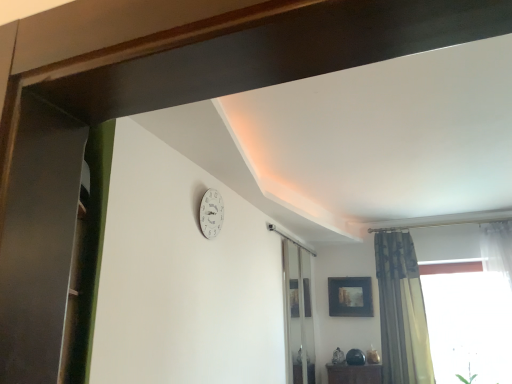
Question: Would you say textured beige curtain at right is part of transparent glass screen door at center, the 2th screen door viewed from the front,'s contents?

Choices:
 (A) no
 (B) yes

Answer: (A)

Question: From the image's perspective, is transparent glass screen door at center, which is the 1th screen door in back-to-front order, below textured beige curtain at right?

Choices:
 (A) yes
 (B) no

Answer: (A)

Question: Is transparent glass screen door at center, which is the 1th screen door in back-to-front order, facing towards textured beige curtain at right?

Choices:
 (A) no
 (B) yes

Answer: (B)

Question: Is transparent glass screen door at center, placed as the second screen door when sorted from left to right, at the left side of textured beige curtain at right?

Choices:
 (A) no
 (B) yes

Answer: (B)

Question: From a real-world perspective, is transparent glass screen door at center, the 1th screen door from the right, located beneath textured beige curtain at right?

Choices:
 (A) yes
 (B) no

Answer: (A)

Question: From the image's perspective, is matte black picture frame at upper center located above or below white matte clock at upper center?

Choices:
 (A) above
 (B) below

Answer: (B)

Question: Looking at their shapes, would you say matte black picture frame at upper center is wider or thinner than white matte clock at upper center?

Choices:
 (A) thin
 (B) wide

Answer: (B)

Question: Is matte black picture frame at upper center taller or shorter than white matte clock at upper center?

Choices:
 (A) short
 (B) tall

Answer: (B)

Question: Would you say matte black picture frame at upper center is to the left or to the right of white matte clock at upper center in the picture?

Choices:
 (A) left
 (B) right

Answer: (B)

Question: Does point (209, 205) appear closer or farther from the camera than point (402, 324)?

Choices:
 (A) closer
 (B) farther

Answer: (A)

Question: Based on their positions, is white matte clock at upper center located to the left or right of textured beige curtain at right?

Choices:
 (A) right
 (B) left

Answer: (B)

Question: Do you think white matte clock at upper center is within textured beige curtain at right, or outside of it?

Choices:
 (A) inside
 (B) outside

Answer: (B)

Question: From the image's perspective, is white matte clock at upper center above or below textured beige curtain at right?

Choices:
 (A) above
 (B) below

Answer: (A)

Question: Relative to matte black picture frame at upper center, is textured beige curtain at right in front or behind?

Choices:
 (A) front
 (B) behind

Answer: (A)

Question: Considering the positions of textured beige curtain at right and matte black picture frame at upper center in the image, is textured beige curtain at right taller or shorter than matte black picture frame at upper center?

Choices:
 (A) short
 (B) tall

Answer: (B)